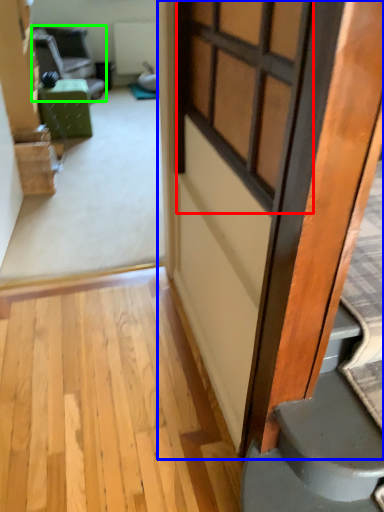
Question: Based on their relative distances, which object is nearer to window (highlighted by a red box)? Choose from door (highlighted by a blue box) and chair (highlighted by a green box).

Choices:
 (A) door
 (B) chair

Answer: (A)